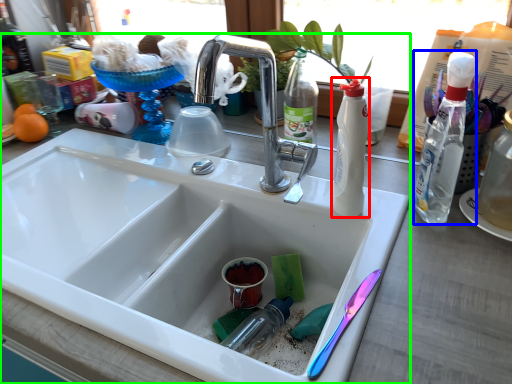
Question: Based on their relative distances, which object is nearer to bottle (highlighted by a red box)? Choose from bottle (highlighted by a blue box) and sink (highlighted by a green box).

Choices:
 (A) bottle
 (B) sink

Answer: (A)